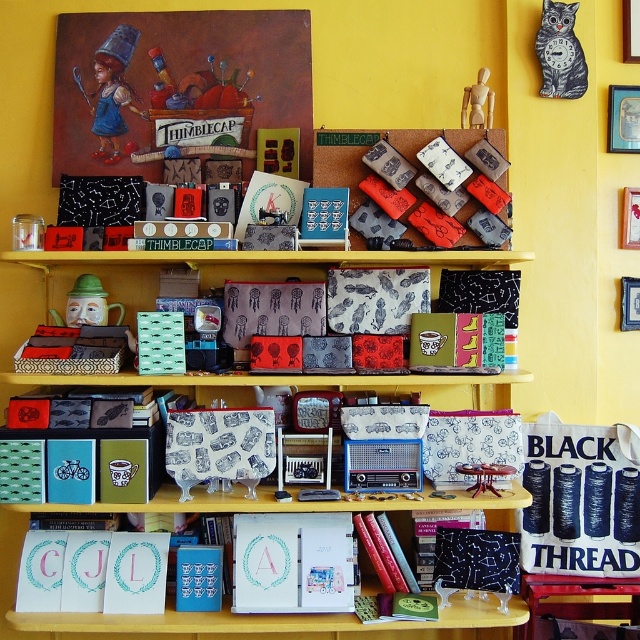
You are standing in front of the yellow shelves and want to hang a new decorative item. The wooden picture frame at upper right is represented by point (630, 218). Where should you place your new item if you want it to be at the same height as the wooden picture frame at upper right?

You should place your new item at the same y coordinate as the wooden picture frame at upper right, which is 0.986.

Consider the image. You are an interior designer looking to hang a new decorative item between the matte black boxes at center and the wooden picture frame at upper right. Based on their heights, which object should you place the new item closer to?

Since the matte black boxes at center are taller than the wooden picture frame at upper right, you should place the new item closer to the wooden picture frame at upper right to maintain visual balance.

You are standing in front of the handmade goods display and want to reach the wooden picture frame at upper right. If you can stretch your arm 2.5 feet, will you be able to touch it?

The wooden picture frame at upper right is 7.50 feet away from the viewer. Since your arm can only stretch 2.5 feet, you cannot reach it without moving closer.